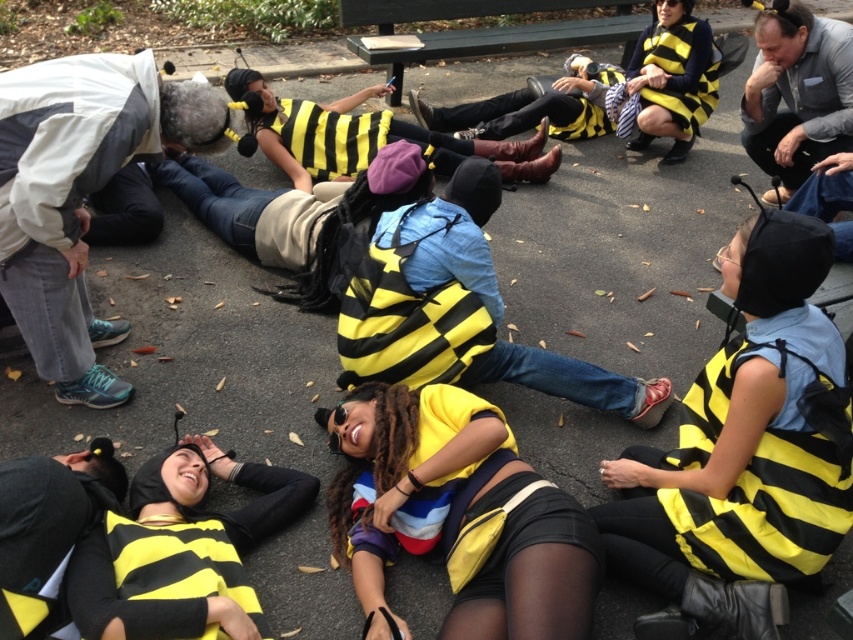
Can you confirm if yellow matte/yellow striped vest at lower center is positioned below yellow striped sweater at center?

Indeed, yellow matte/yellow striped vest at lower center is positioned under yellow striped sweater at center.

Locate an element on the screen. The width and height of the screenshot is (853, 640). yellow matte/yellow striped vest at lower center is located at coordinates (415, 474).

I want to click on yellow matte/yellow striped vest at lower center, so click(415, 474).